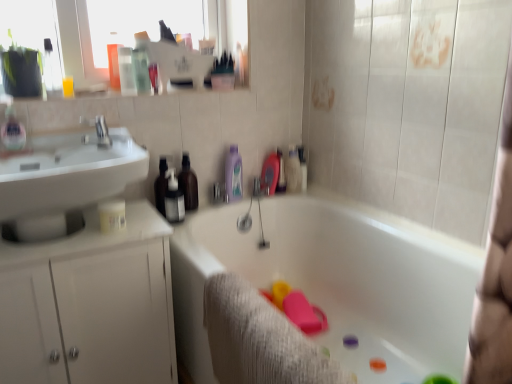
At what (x,y) coordinates should I click in order to perform the action: click on vacant space that is to the left of silver metallic faucet at upper left. Please return your answer as a coordinate pair (x, y). The height and width of the screenshot is (384, 512). Looking at the image, I should click on (61, 144).